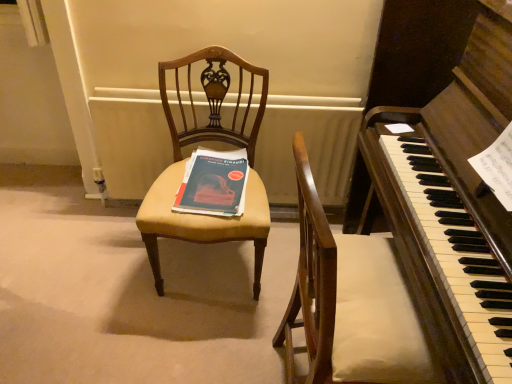
The image size is (512, 384). What are the coordinates of `free space above white painted radiator at center (from a real-world perspective)` in the screenshot? It's located at (223, 102).